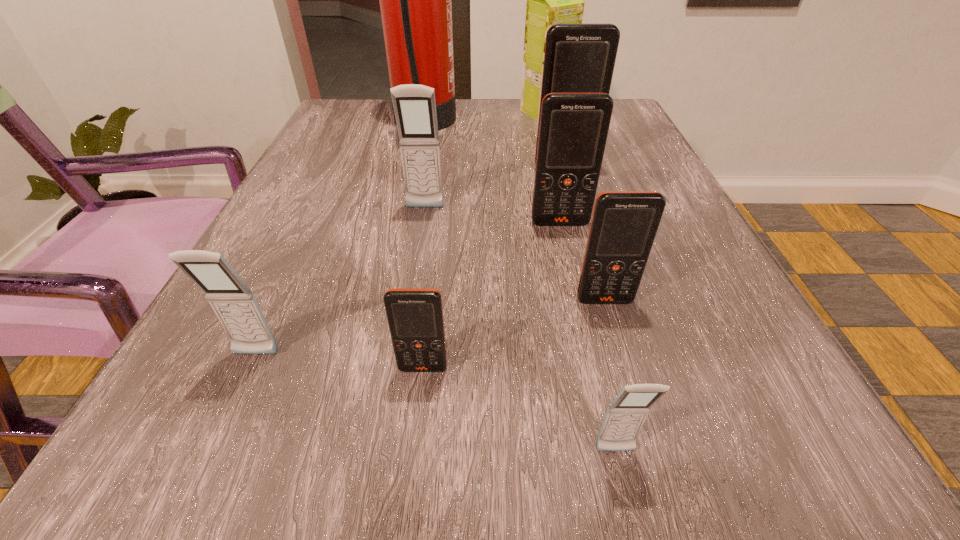
The height and width of the screenshot is (540, 960). Identify the location of vacant space in between the smallest orange cellular telephone and the green soya milk. (484, 240).

Where is `free space that is in between the farthest orange cellular telephone and the tallest object`? free space that is in between the farthest orange cellular telephone and the tallest object is located at coordinates (x=494, y=147).

The height and width of the screenshot is (540, 960). I want to click on vacant space that's between the rightmost gray cellular telephone and the farthest gray cellular telephone, so click(x=520, y=330).

You are a GUI agent. You are given a task and a screenshot of the screen. Output one action in this format:
    pyautogui.click(x=<x>, y=<y>)
    Task: Click on the vacant space that's between the fourth nearest object and the seventh nearest object
    
    Given the screenshot: What is the action you would take?
    pyautogui.click(x=584, y=235)

Where is `unoccupied position between the third farthest orange cellular telephone and the second biggest orange cellular telephone`? The image size is (960, 540). unoccupied position between the third farthest orange cellular telephone and the second biggest orange cellular telephone is located at coordinates (582, 262).

The image size is (960, 540). I want to click on free spot between the red fire extinguisher and the fourth nearest cellular telephone, so [x=515, y=213].

This screenshot has height=540, width=960. I want to click on empty location between the nearest object and the second gray cellular telephone from left to right, so click(x=520, y=330).

Identify the location of object that is the eighth nearest to the second farthest orange cellular telephone. Image resolution: width=960 pixels, height=540 pixels. (236, 307).

Identify which object is the fourth closest to the tallest object. Please provide its 2D coordinates. Your answer should be formatted as a tuple, i.e. [(x, y)], where the tuple contains the x and y coordinates of a point satisfying the conditions above.

[(573, 131)]

Choose which cellular telephone is the fourth nearest neighbor to the red fire extinguisher. Please provide its 2D coordinates. Your answer should be formatted as a tuple, i.e. [(x, y)], where the tuple contains the x and y coordinates of a point satisfying the conditions above.

[(624, 224)]